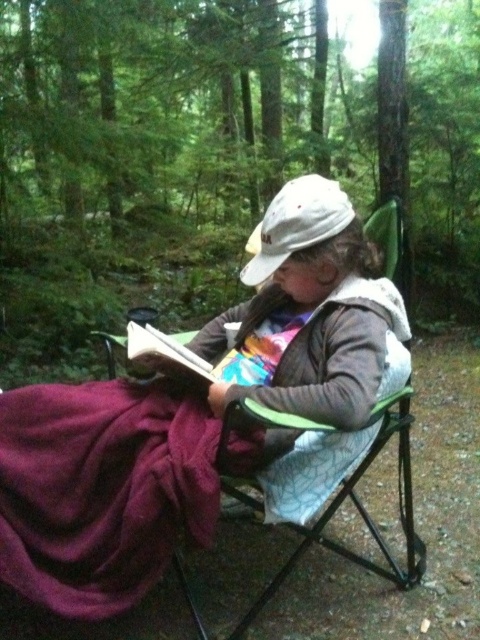
Question: Among these points, which one is farthest from the camera?

Choices:
 (A) (288, 308)
 (B) (137, 248)

Answer: (B)

Question: Considering the real-world distances, which object is closest to the maroon fleece blanket at lower left?

Choices:
 (A) white fabric cap at center
 (B) green matte chair at center
 (C) matte purple blanket at lower left

Answer: (C)

Question: Can you confirm if maroon fleece blanket at lower left is thinner than white fabric cap at center?

Choices:
 (A) yes
 (B) no

Answer: (B)

Question: In this image, where is matte purple blanket at lower left located relative to white fabric cap at center?

Choices:
 (A) right
 (B) left

Answer: (B)

Question: Can you confirm if matte purple blanket at lower left is smaller than white fabric cap at center?

Choices:
 (A) yes
 (B) no

Answer: (B)

Question: Among these objects, which one is farthest from the camera?

Choices:
 (A) white fabric cap at center
 (B) matte purple blanket at lower left
 (C) maroon fleece blanket at lower left
 (D) green matte chair at center

Answer: (D)